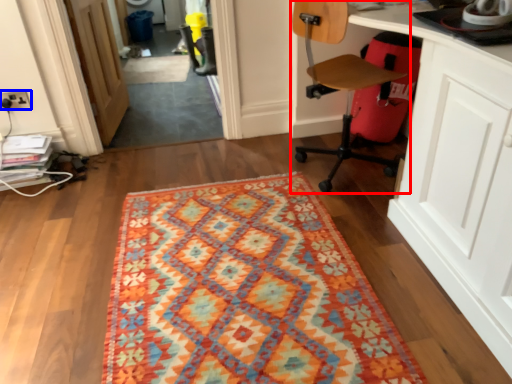
Question: Among these objects, which one is farthest to the camera, chair (highlighted by a red box) or electric outlet (highlighted by a blue box)?

Choices:
 (A) chair
 (B) electric outlet

Answer: (B)